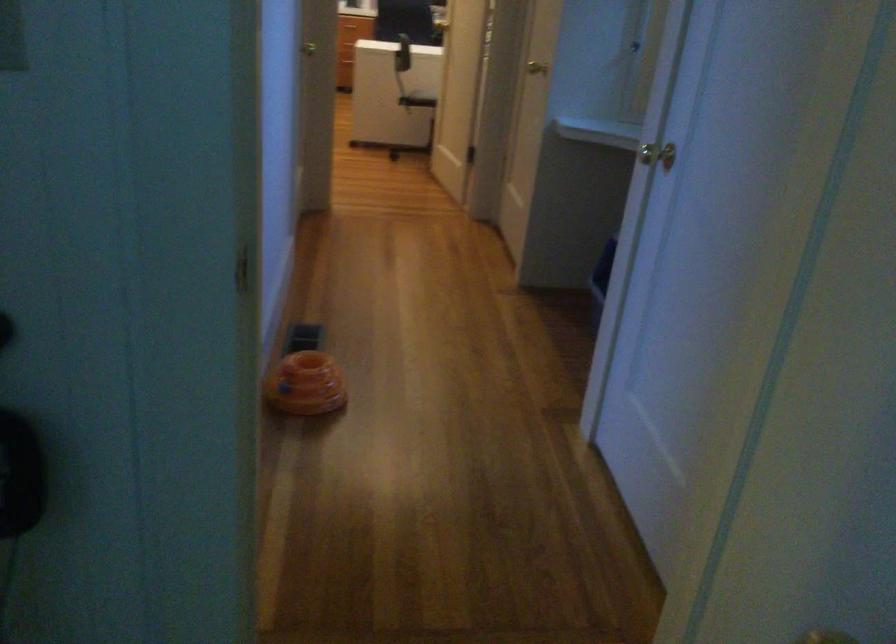
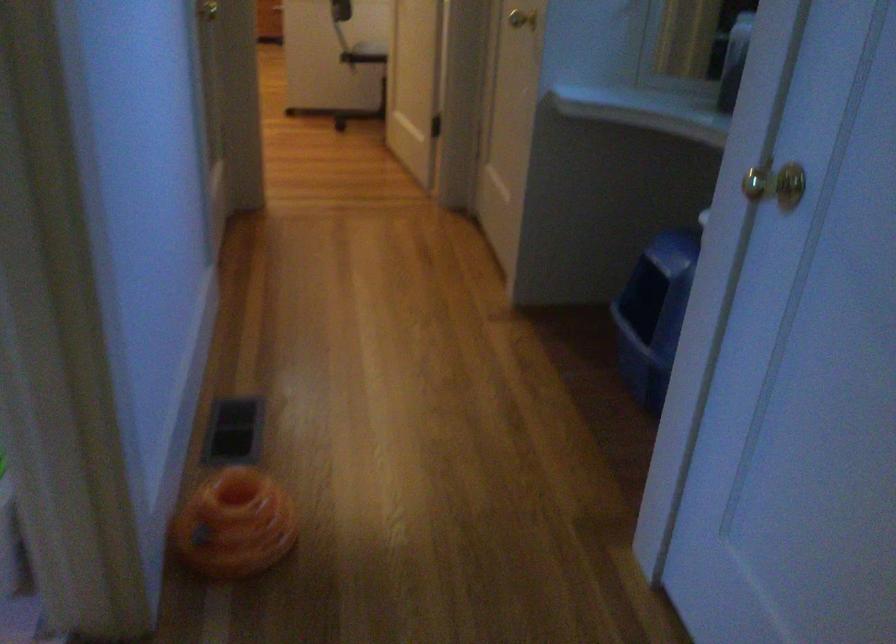
Question: The images are taken continuously from a first-person perspective. In which direction are you moving?

Choices:
 (A) Left
 (B) Right
 (C) Forward
 (D) Backward

Answer: (C)